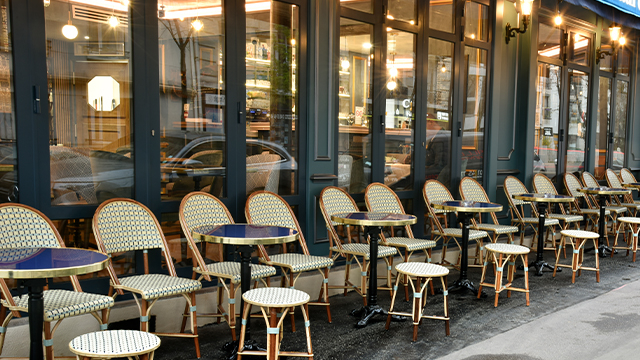
Locate an element on the screen. tables is located at coordinates (65, 266), (244, 237), (394, 219), (481, 209), (553, 200), (614, 190).